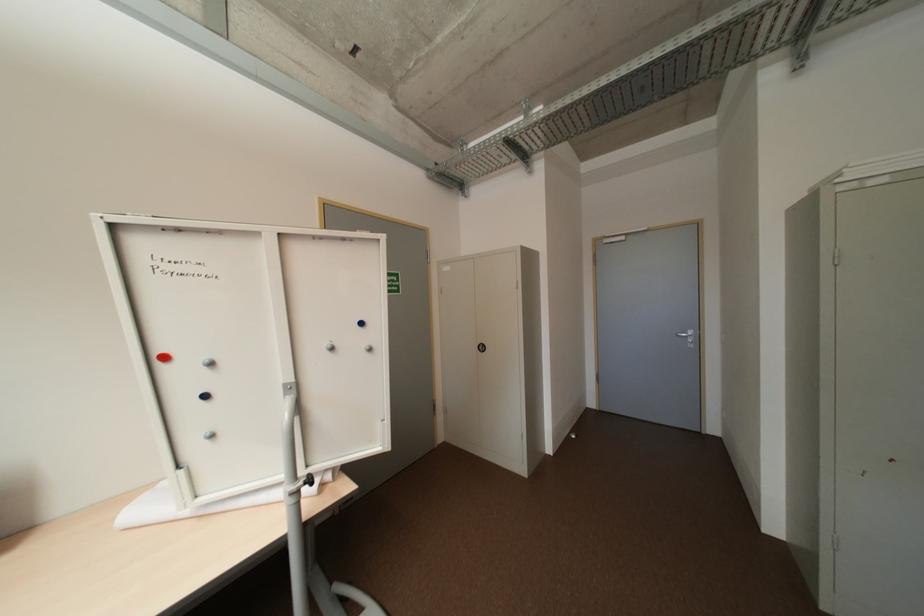
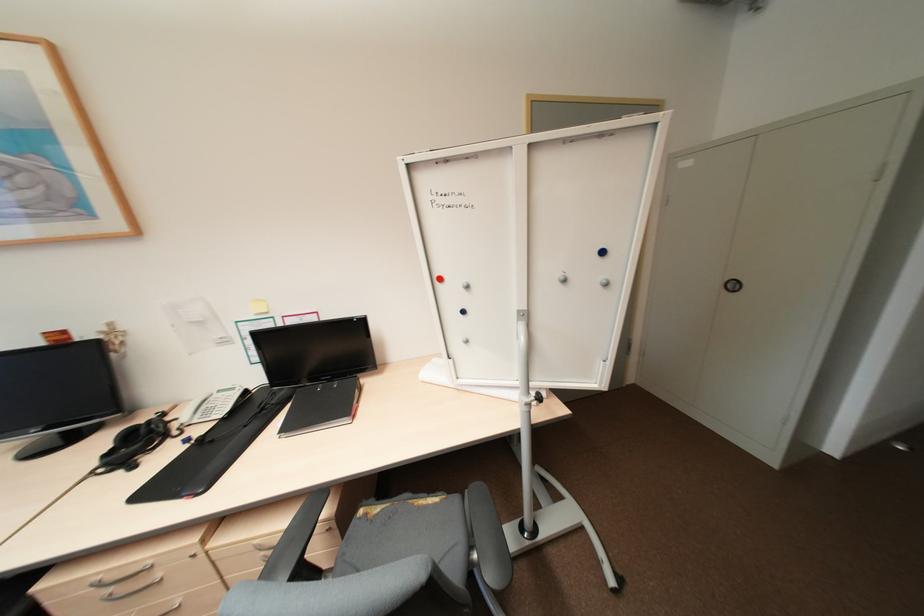
In the second image, find the point that corresponds to point (488, 347) in the first image.

(738, 286)